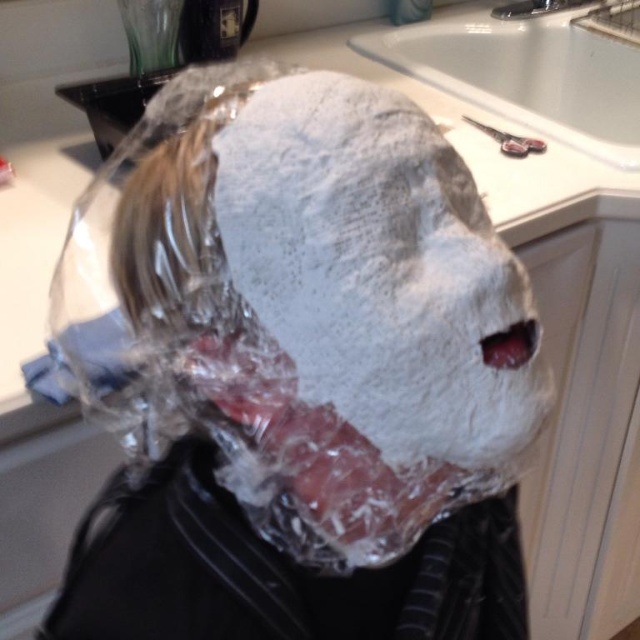
Looking at this image, can you confirm if white powder mask at center is wider than white ceramic sink at upper center?

No, white powder mask at center is not wider than white ceramic sink at upper center.

Does white powder mask at center appear on the left side of white ceramic sink at upper center?

Yes, white powder mask at center is to the left of white ceramic sink at upper center.

Who is more forward, (259, 109) or (413, 45)?

Positioned in front is point (259, 109).

You are a GUI agent. You are given a task and a screenshot of the screen. Output one action in this format:
    pyautogui.click(x=<x>, y=<y>)
    Task: Click on the white powder mask at center
    
    Given the screenshot: What is the action you would take?
    pyautogui.click(x=380, y=269)